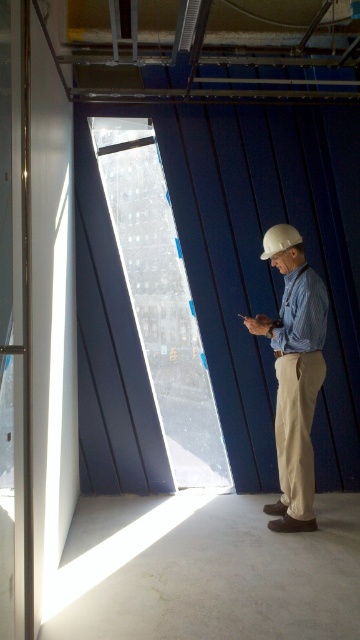
Question: Can you confirm if striped cotton shirt at center is positioned below white matte helmet at center?

Choices:
 (A) no
 (B) yes

Answer: (B)

Question: Which of the following is the farthest from the observer?

Choices:
 (A) striped cotton shirt at center
 (B) white matte helmet at center

Answer: (B)

Question: Can you confirm if striped cotton shirt at center is wider than white matte helmet at center?

Choices:
 (A) yes
 (B) no

Answer: (A)

Question: Is striped cotton shirt at center further to camera compared to white matte helmet at center?

Choices:
 (A) no
 (B) yes

Answer: (A)

Question: Which object is farther from the camera taking this photo?

Choices:
 (A) striped cotton shirt at center
 (B) white matte helmet at center

Answer: (B)